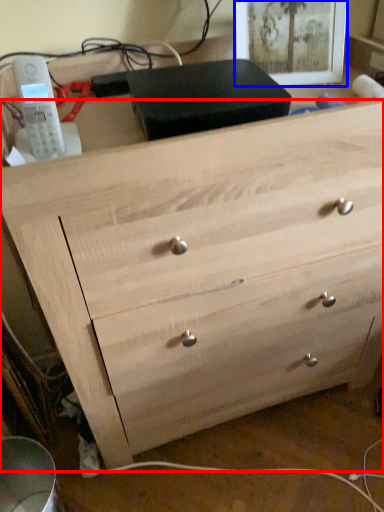
Question: Which of the following is the farthest to the observer, chest of drawers (highlighted by a red box) or picture frame (highlighted by a blue box)?

Choices:
 (A) chest of drawers
 (B) picture frame

Answer: (B)